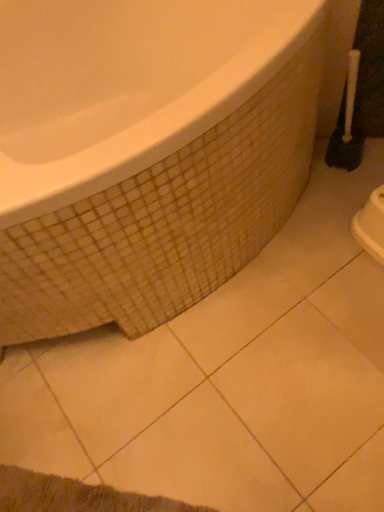
At what (x,y) coordinates should I click in order to perform the action: click on free space to the left of white plastic toilet brush at right. Please return your answer as a coordinate pair (x, y). Image resolution: width=384 pixels, height=512 pixels. Looking at the image, I should click on (313, 182).